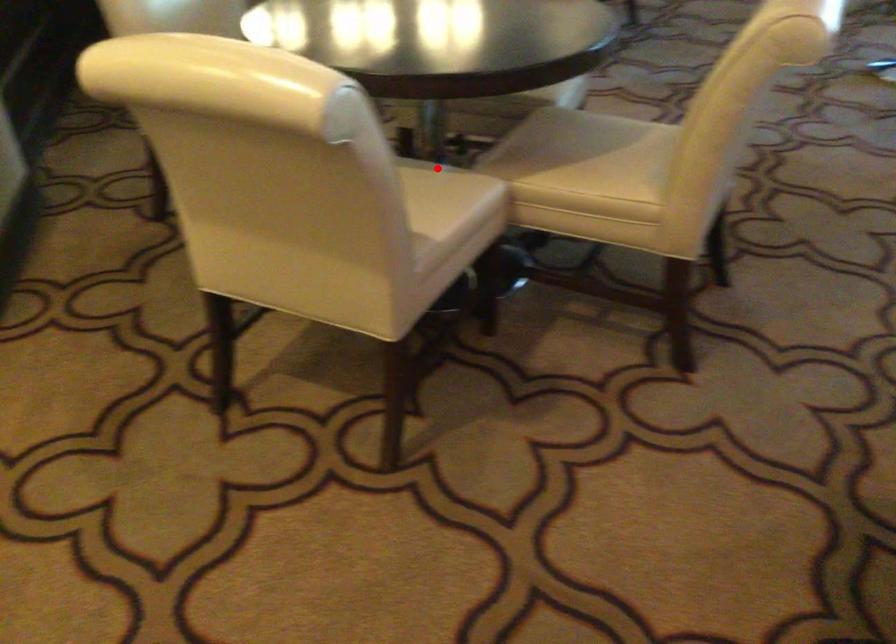
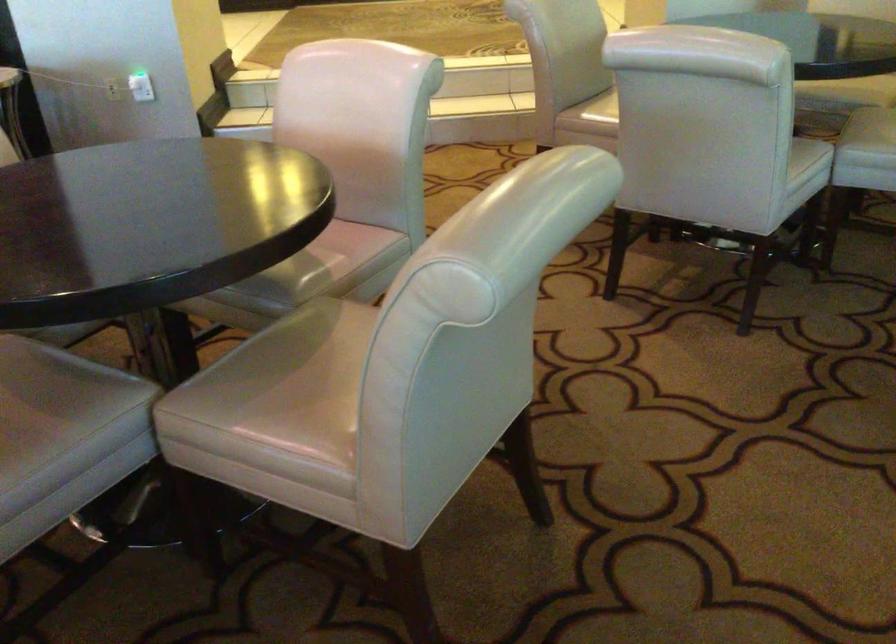
Question: I am providing you with two images of the same scene from different viewpoints. A red point is marked on the first image. Can you still see the location of the red point in image 2?

Choices:
 (A) Yes
 (B) No

Answer: (B)